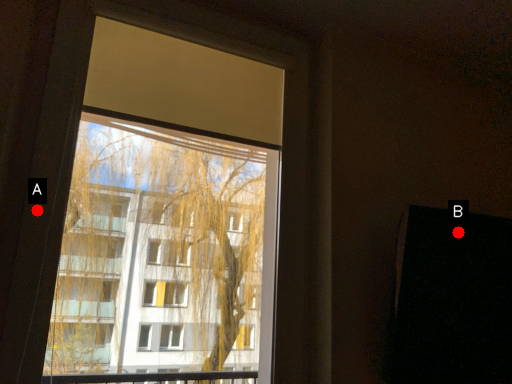
Question: Two points are circled on the image, labeled by A and B beside each circle. Among these points, which one is nearest to the camera?

Choices:
 (A) A is closer
 (B) B is closer

Answer: (A)